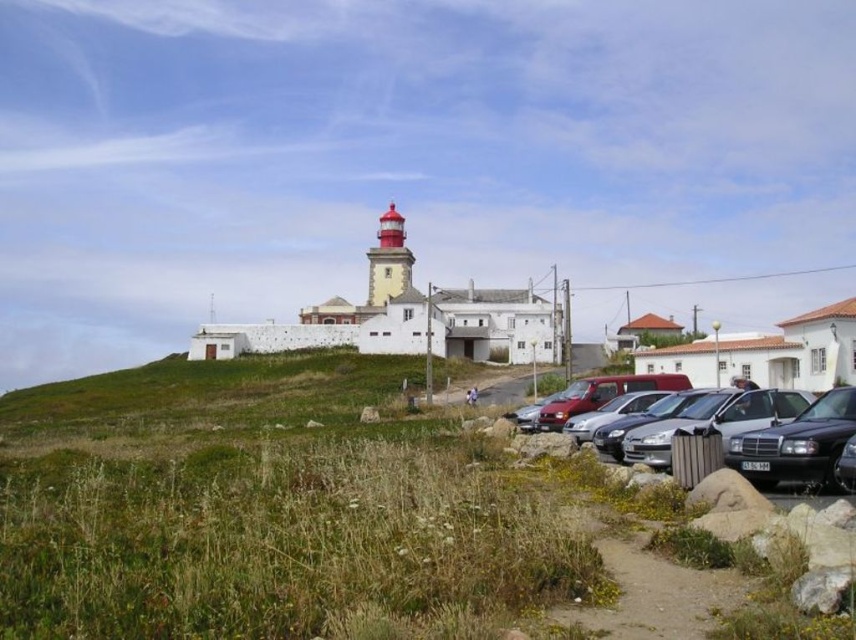
You are standing at the point marked as point (278, 508) in the coastal scene. Looking towards the lighthouse, which direction should you walk to reach the lighthouse?

The point (278, 508) is on green grass at lower left. To reach the lighthouse, you should walk towards the upper right direction.

You are standing at the edge of the dirt path in the coastal scene. You see the green grass at lower left and the shiny black sedan at lower right. Which object is nearer to you?

The green grass at lower left is closer to the viewer than the shiny black sedan at lower right.